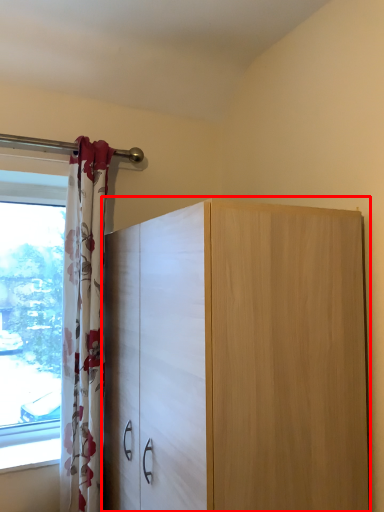
Question: From the image, what is the correct spatial relationship of cupboard (annotated by the red box) in relation to curtain?

Choices:
 (A) right
 (B) left

Answer: (A)